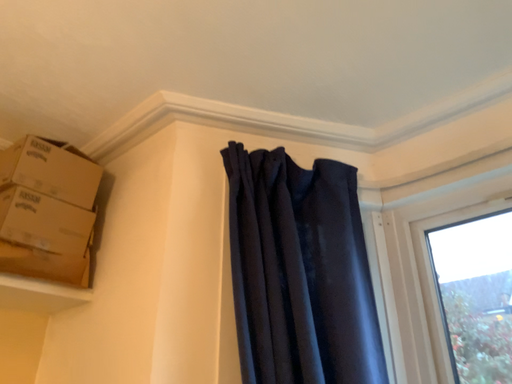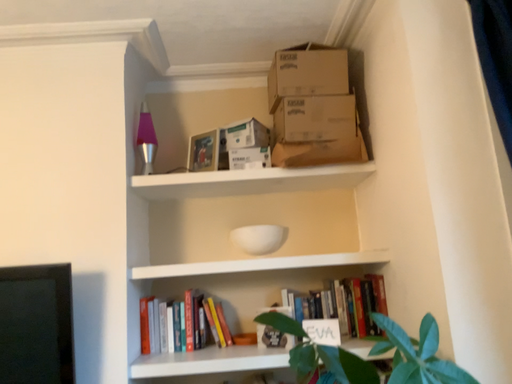
Question: Which way did the camera rotate in the video?

Choices:
 (A) rotated upward
 (B) rotated downward

Answer: (B)